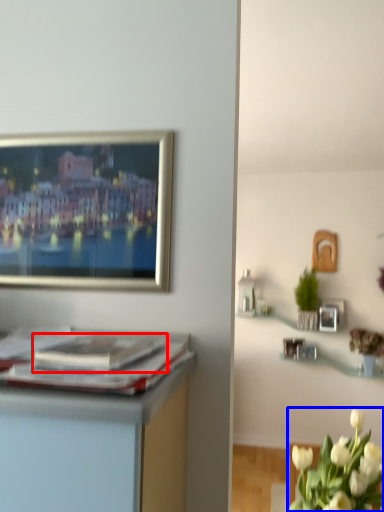
Question: Which of the following is the closest to the observer, magazine (highlighted by a red box) or flower (highlighted by a blue box)?

Choices:
 (A) magazine
 (B) flower

Answer: (A)